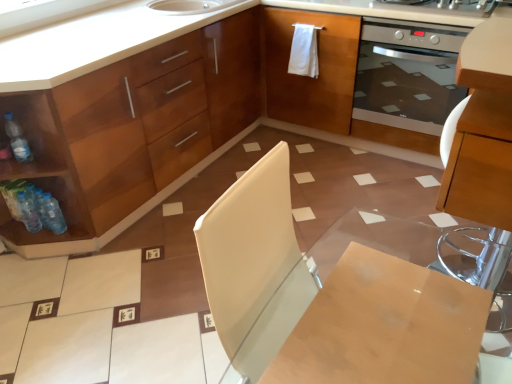
What is the approximate width of matte wood cabinet at center?

It is 28.80 inches.

Where is `matte wood cabinet at center`? matte wood cabinet at center is located at coordinates (178, 119).

Image resolution: width=512 pixels, height=384 pixels. What are the coordinates of `translucent plastic bottles at lower left, the 2th bottle when ordered from bottom to top` in the screenshot? It's located at (29, 211).

What do you see at coordinates (407, 74) in the screenshot? I see `satin silver oven at right` at bounding box center [407, 74].

You are a GUI agent. You are given a task and a screenshot of the screen. Output one action in this format:
    pyautogui.click(x=<x>, y=<y>)
    Task: Click on the matte wood cabinet at center
    Image resolution: width=512 pixels, height=384 pixels.
    Given the screenshot: What is the action you would take?
    pyautogui.click(x=178, y=119)

Is clear plastic bottle at left, marked as the third bottle in a bottom-to-top arrangement, completely or partially outside of matte wood cabinet at center?

Actually, clear plastic bottle at left, marked as the third bottle in a bottom-to-top arrangement, is within matte wood cabinet at center.

From a real-world perspective, who is located higher, clear plastic bottle at left, the 1th bottle in the top-to-bottom sequence, or matte wood cabinet at center?

From a 3D spatial view, clear plastic bottle at left, the 1th bottle in the top-to-bottom sequence, is above.

Considering the relative sizes of clear plastic bottle at left, the 1th bottle in the top-to-bottom sequence, and matte wood cabinet at center in the image provided, is clear plastic bottle at left, the 1th bottle in the top-to-bottom sequence, thinner than matte wood cabinet at center?

Yes, clear plastic bottle at left, the 1th bottle in the top-to-bottom sequence, is thinner than matte wood cabinet at center.

Where is `cabinetry on the right of clear plastic bottle at left, marked as the third bottle in a bottom-to-top arrangement`? This screenshot has width=512, height=384. cabinetry on the right of clear plastic bottle at left, marked as the third bottle in a bottom-to-top arrangement is located at coordinates (178, 119).

Is wooden table at center positioned far away from translucent plastic bottles at lower left, the second bottle positioned from the top?

That's right, there is a large distance between wooden table at center and translucent plastic bottles at lower left, the second bottle positioned from the top.

Considering the sizes of objects wooden table at center and translucent plastic bottles at lower left, the 2th bottle when ordered from bottom to top, in the image provided, who is thinner, wooden table at center or translucent plastic bottles at lower left, the 2th bottle when ordered from bottom to top,?

With smaller width is translucent plastic bottles at lower left, the 2th bottle when ordered from bottom to top.

What are the coordinates of `table located in front of the translucent plastic bottles at lower left, the 2th bottle when ordered from bottom to top` in the screenshot? It's located at pos(383,312).

Who is more distant, wooden table at center or translucent plastic bottles at lower left, the 2th bottle when ordered from bottom to top?

translucent plastic bottles at lower left, the 2th bottle when ordered from bottom to top, is further from the camera.

From the picture: From the image's perspective, is clear plastic bottle at left, marked as the third bottle in a bottom-to-top arrangement, over translucent plastic bottles at lower left, the 2th bottle when ordered from bottom to top?

Correct, clear plastic bottle at left, marked as the third bottle in a bottom-to-top arrangement, appears higher than translucent plastic bottles at lower left, the 2th bottle when ordered from bottom to top, in the image.

Is clear plastic bottle at left, marked as the third bottle in a bottom-to-top arrangement, facing towards translucent plastic bottles at lower left, the 2th bottle when ordered from bottom to top?

No, clear plastic bottle at left, marked as the third bottle in a bottom-to-top arrangement, does not turn towards translucent plastic bottles at lower left, the 2th bottle when ordered from bottom to top.

Considering the positions of objects clear plastic bottle at left, marked as the third bottle in a bottom-to-top arrangement, and translucent plastic bottles at lower left, the 2th bottle when ordered from bottom to top, in the image provided, who is behind, clear plastic bottle at left, marked as the third bottle in a bottom-to-top arrangement, or translucent plastic bottles at lower left, the 2th bottle when ordered from bottom to top,?

translucent plastic bottles at lower left, the 2th bottle when ordered from bottom to top, is further away from the camera.

Between translucent plastic bottle at lower left, which is the 3th bottle from top to bottom, and clear plastic bottle at left, the 1th bottle in the top-to-bottom sequence, which one appears on the right side from the viewer's perspective?

Positioned to the right is translucent plastic bottle at lower left, which is the 3th bottle from top to bottom.

Is translucent plastic bottle at lower left, which is the 3th bottle from top to bottom, inside the boundaries of clear plastic bottle at left, marked as the third bottle in a bottom-to-top arrangement, or outside?

translucent plastic bottle at lower left, which is the 3th bottle from top to bottom, exists outside the volume of clear plastic bottle at left, marked as the third bottle in a bottom-to-top arrangement.

From the image's perspective, is translucent plastic bottle at lower left, which is the 3th bottle from top to bottom, on clear plastic bottle at left, the 1th bottle in the top-to-bottom sequence?

Actually, translucent plastic bottle at lower left, which is the 3th bottle from top to bottom, appears below clear plastic bottle at left, the 1th bottle in the top-to-bottom sequence, in the image.

Considering their positions, is translucent plastic bottle at lower left, which is the 3th bottle from top to bottom, located in front of or behind clear plastic bottle at left, marked as the third bottle in a bottom-to-top arrangement?

translucent plastic bottle at lower left, which is the 3th bottle from top to bottom, is positioned farther from the viewer than clear plastic bottle at left, marked as the third bottle in a bottom-to-top arrangement.

Is translucent plastic bottle at lower left, the first bottle from the bottom, far away from translucent plastic bottles at lower left, the 2th bottle when ordered from bottom to top?

Actually, translucent plastic bottle at lower left, the first bottle from the bottom, and translucent plastic bottles at lower left, the 2th bottle when ordered from bottom to top, are a little close together.

What's the angular difference between translucent plastic bottle at lower left, the first bottle from the bottom, and translucent plastic bottles at lower left, the 2th bottle when ordered from bottom to top,'s facing directions?

There is a 7.04e-05-degree angle between the facing directions of translucent plastic bottle at lower left, the first bottle from the bottom, and translucent plastic bottles at lower left, the 2th bottle when ordered from bottom to top.

Which of these two, translucent plastic bottle at lower left, the first bottle from the bottom, or translucent plastic bottles at lower left, the 2th bottle when ordered from bottom to top, is bigger?

translucent plastic bottles at lower left, the 2th bottle when ordered from bottom to top, is bigger.

Which is more to the left, matte wood cabinet at center or wooden table at center?

From the viewer's perspective, matte wood cabinet at center appears more on the left side.

I want to click on table located below the matte wood cabinet at center (from the image's perspective), so click(383, 312).

From the image's perspective, between matte wood cabinet at center and wooden table at center, which one is located above?

matte wood cabinet at center appears higher in the image.

Are wooden table at center and satin silver oven at right far apart?

wooden table at center is near satin silver oven at right, not far away.

Can satin silver oven at right be found inside wooden table at center?

No, satin silver oven at right is not a part of wooden table at center.

Between wooden table at center and satin silver oven at right, which one is positioned in front?

wooden table at center is more forward.

What are the coordinates of `cabinetry above the clear plastic bottle at left, marked as the third bottle in a bottom-to-top arrangement (from the image's perspective)` in the screenshot? It's located at click(x=178, y=119).

At what (x,y) coordinates should I click in order to perform the action: click on the 2nd bottle positioned below the wooden table at center (from a real-world perspective). Please return your answer as a coordinate pair (x, y). The image size is (512, 384). Looking at the image, I should click on (29, 211).

Looking at the image, which one is located further to stainless steel oven at upper right, matte wood cabinet at center or clear plastic bottle at left, marked as the third bottle in a bottom-to-top arrangement?

Among the two, clear plastic bottle at left, marked as the third bottle in a bottom-to-top arrangement, is located further to stainless steel oven at upper right.

From the image, which object appears to be nearer to translucent plastic bottle at lower left, the first bottle from the bottom, satin silver oven at right or translucent plastic bottles at lower left, the 2th bottle when ordered from bottom to top?

translucent plastic bottles at lower left, the 2th bottle when ordered from bottom to top, lies closer to translucent plastic bottle at lower left, the first bottle from the bottom, than the other object.

Estimate the real-world distances between objects in this image. Which object is closer to translucent plastic bottle at lower left, the first bottle from the bottom, wooden table at center or stainless steel oven at upper right?

wooden table at center.

When comparing their distances from translucent plastic bottles at lower left, the 2th bottle when ordered from bottom to top, does wooden table at center or matte wood cabinet at center seem closer?

matte wood cabinet at center is closer to translucent plastic bottles at lower left, the 2th bottle when ordered from bottom to top.

Estimate the real-world distances between objects in this image. Which object is further from satin silver oven at right, clear plastic bottle at left, marked as the third bottle in a bottom-to-top arrangement, or translucent plastic bottles at lower left, the 2th bottle when ordered from bottom to top?

translucent plastic bottles at lower left, the 2th bottle when ordered from bottom to top, is further to satin silver oven at right.

From the picture: Looking at the image, which one is located further to satin silver oven at right, wooden table at center or stainless steel oven at upper right?

Among the two, wooden table at center is located further to satin silver oven at right.

When comparing their distances from translucent plastic bottle at lower left, the first bottle from the bottom, does translucent plastic bottles at lower left, the second bottle positioned from the top, or wooden table at center seem further?

wooden table at center lies further to translucent plastic bottle at lower left, the first bottle from the bottom, than the other object.

From the picture: Based on their spatial positions, is matte wood cabinet at center or translucent plastic bottles at lower left, the second bottle positioned from the top, further from translucent plastic bottle at lower left, which is the 3th bottle from top to bottom?

Based on the image, matte wood cabinet at center appears to be further to translucent plastic bottle at lower left, which is the 3th bottle from top to bottom.

Find the location of a particular element. This screenshot has width=512, height=384. table situated between matte wood cabinet at center and stainless steel oven at upper right from left to right is located at coordinates coord(383,312).

Identify the location of cabinetry between translucent plastic bottle at lower left, which is the 3th bottle from top to bottom, and stainless steel oven at upper right. The height and width of the screenshot is (384, 512). (178, 119).

What are the coordinates of `cabinetry positioned between wooden table at center and translucent plastic bottles at lower left, the second bottle positioned from the top, from near to far` in the screenshot? It's located at (178, 119).

I want to click on cabinetry between clear plastic bottle at left, the 1th bottle in the top-to-bottom sequence, and wooden table at center, so click(178, 119).